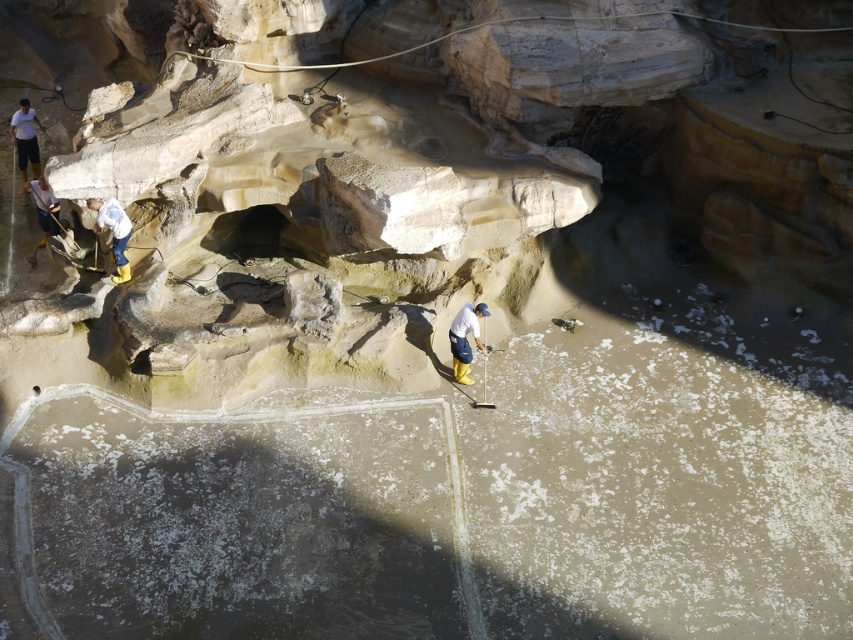
You are an inspector at the quarry site. You notice two white items in the cleared area. The white fabric at left and the white matte shirt at upper left. Which item is shorter in height?

The white fabric at left is not as tall as the white matte shirt at upper left, so the white fabric at left is shorter in height.

You are standing at the quarry site and see a white matte shirt at center and a white matte helmet at upper left. Which object is nearer to you?

The white matte shirt at center is closer to the viewer than the white matte helmet at upper left.